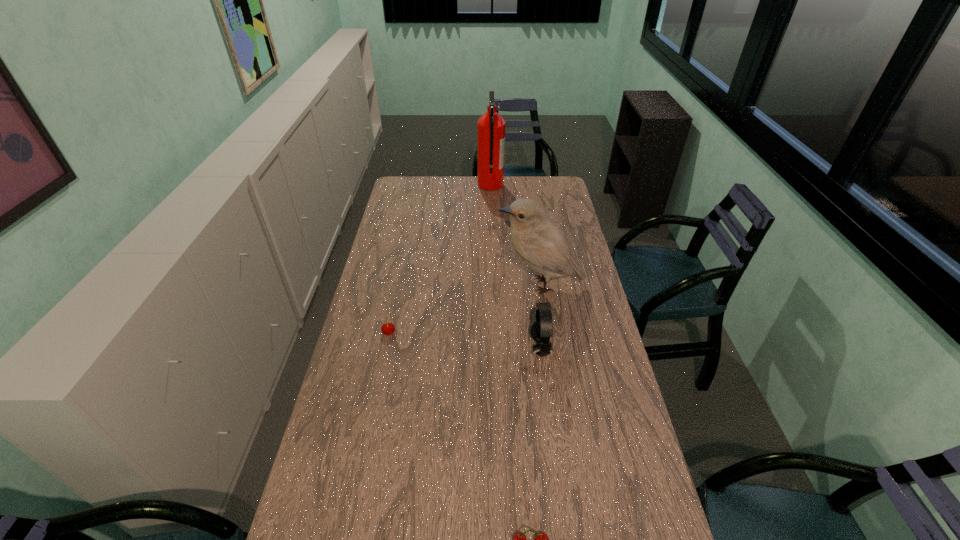
In the image, there is a desktop. At what (x,y) coordinates should I click in order to perform the action: click on vacant area at the far edge. Please return your answer as a coordinate pair (x, y). The height and width of the screenshot is (540, 960). Looking at the image, I should click on (454, 180).

Locate an element on the screen. vacant space at the left edge is located at coordinates (409, 280).

This screenshot has width=960, height=540. In the image, there is a desktop. Identify the location of vacant region at the right edge. (583, 253).

In the image, there is a desktop. At what (x,y) coordinates should I click in order to perform the action: click on vacant region at the far right corner. Please return your answer as a coordinate pair (x, y). Image resolution: width=960 pixels, height=540 pixels. Looking at the image, I should click on (557, 194).

The width and height of the screenshot is (960, 540). I want to click on vacant area that lies between the earphone and the farthest object, so click(516, 266).

I want to click on free spot between the farther cherry and the parakeet, so click(465, 309).

Find the location of a particular element. This screenshot has width=960, height=540. free space between the leftmost object and the earphone is located at coordinates (465, 340).

Locate an element on the screen. This screenshot has width=960, height=540. object that is the second closest one to the earphone is located at coordinates (388, 328).

The image size is (960, 540). I want to click on the closest object to the third tallest object, so click(538, 241).